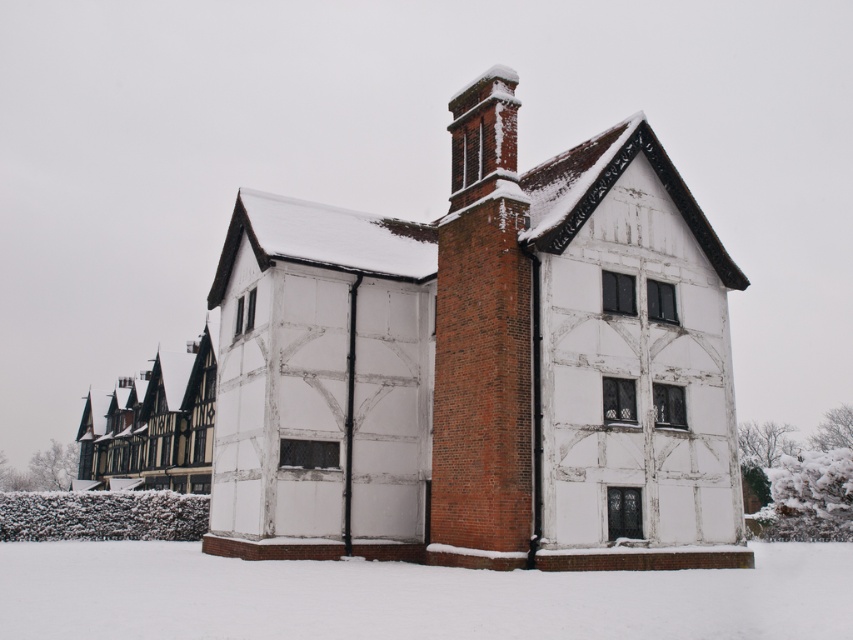
Can you confirm if white powdery snow at lower center is shorter than red brick chimney at upper center?

Indeed, white powdery snow at lower center has a lesser height compared to red brick chimney at upper center.

How much distance is there between white powdery snow at lower center and red brick chimney at upper center?

A distance of 11.53 meters exists between white powdery snow at lower center and red brick chimney at upper center.

Image resolution: width=853 pixels, height=640 pixels. I want to click on white powdery snow at lower center, so click(x=409, y=596).